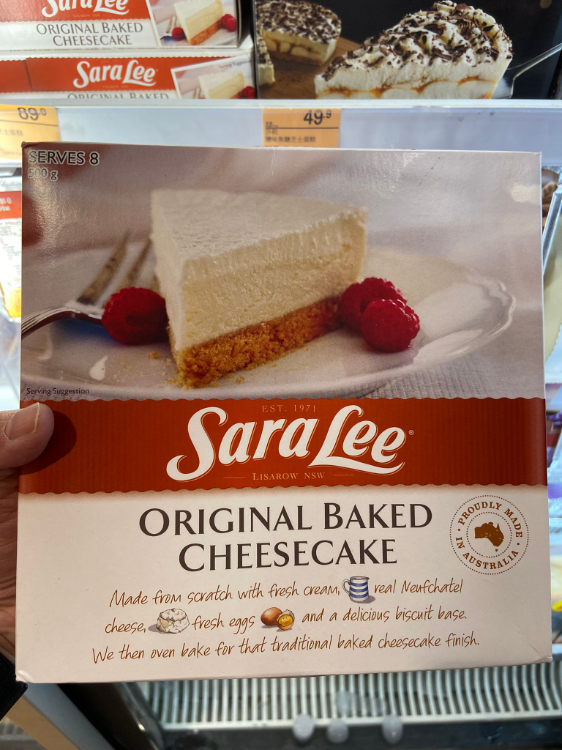
Image resolution: width=562 pixels, height=750 pixels. I want to click on freezer rack, so [x=197, y=703], [x=370, y=712], [x=468, y=699].